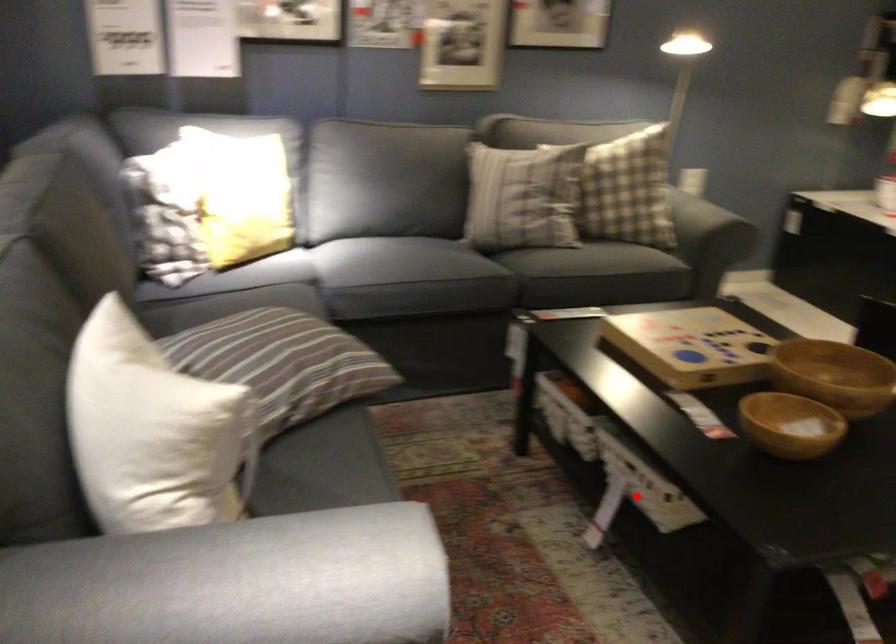
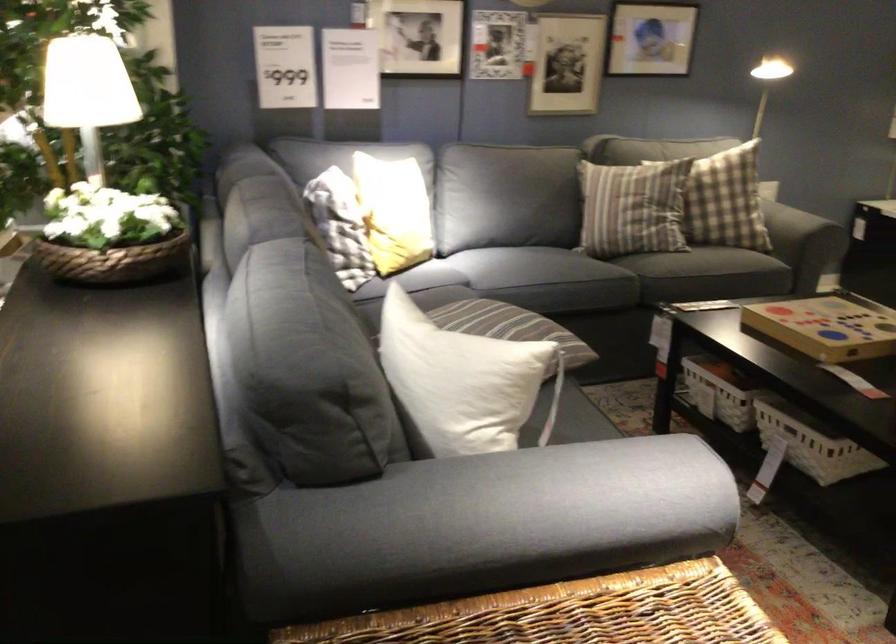
Where in the second image is the point corresponding to the highlighted location from the first image?

(814, 448)